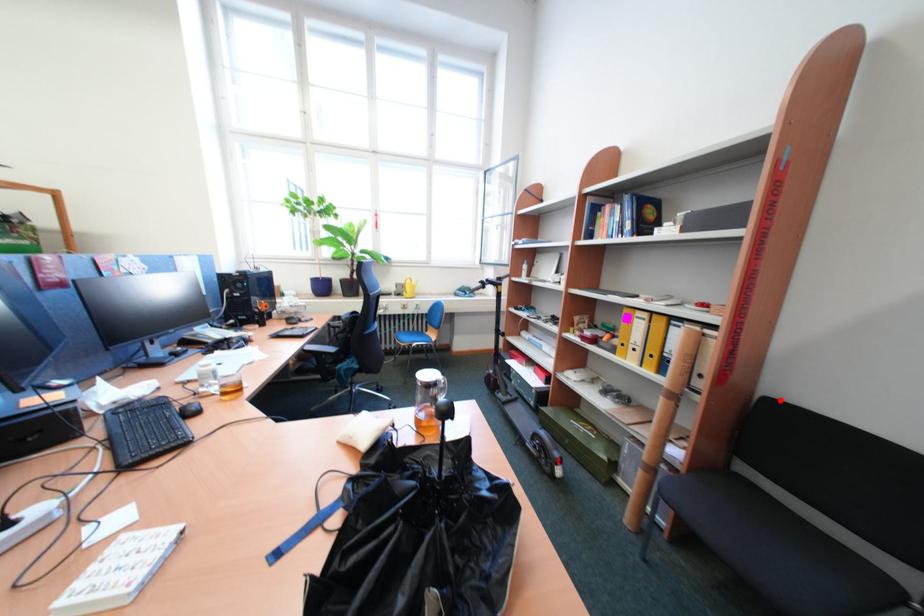
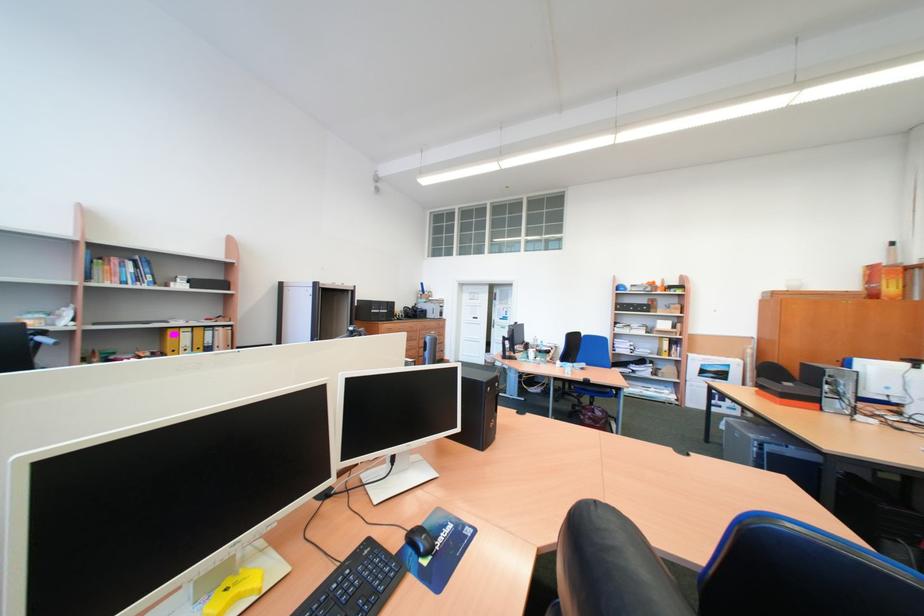
Question: I am providing you with two images of the same scene from different viewpoints. A red point is marked on the first image. At the location where the point appears in image 1, is it still visible in image 2?

Choices:
 (A) Yes
 (B) No

Answer: (B)